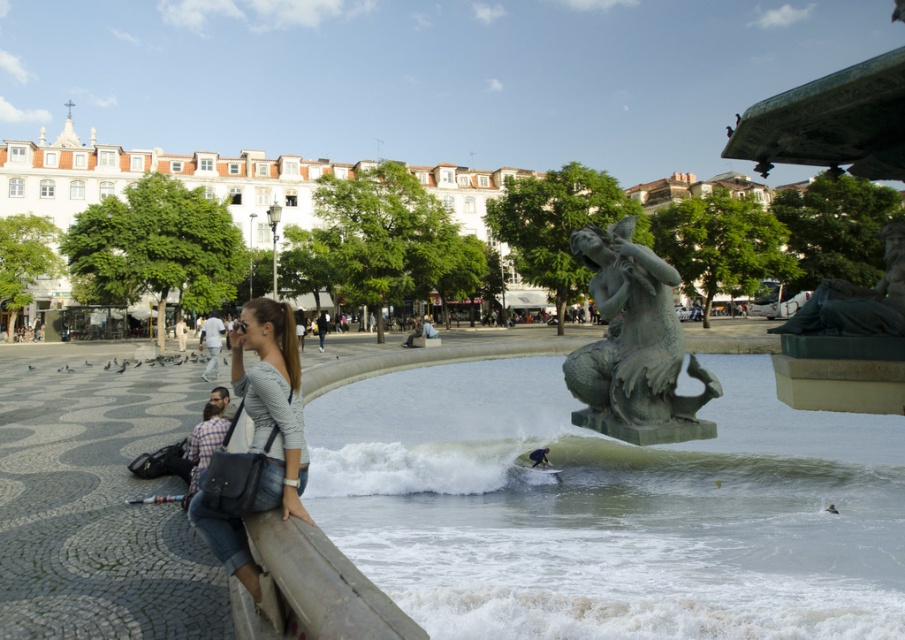
Question: From the image, what is the correct spatial relationship of light brown leather jacket at center in relation to smooth green surfboard at center?

Choices:
 (A) above
 (B) below

Answer: (A)

Question: Can you confirm if green patina statue at center is smaller than smooth green surfboard at center?

Choices:
 (A) no
 (B) yes

Answer: (A)

Question: Can you confirm if green stone water at center is positioned to the right of green patina statue at center?

Choices:
 (A) yes
 (B) no

Answer: (A)

Question: Among these points, which one is nearest to the camera?

Choices:
 (A) (456, 550)
 (B) (218, 372)
 (C) (532, 458)
 (D) (252, 417)

Answer: (D)

Question: Which of the following is the farthest from the observer?

Choices:
 (A) (208, 352)
 (B) (760, 611)
 (C) (543, 460)
 (D) (286, 323)

Answer: (A)

Question: Which of these objects is positioned closest to the light brown leather jacket at center?

Choices:
 (A) smooth green surfboard at center
 (B) green patina statue at center
 (C) denim jacket at left

Answer: (A)